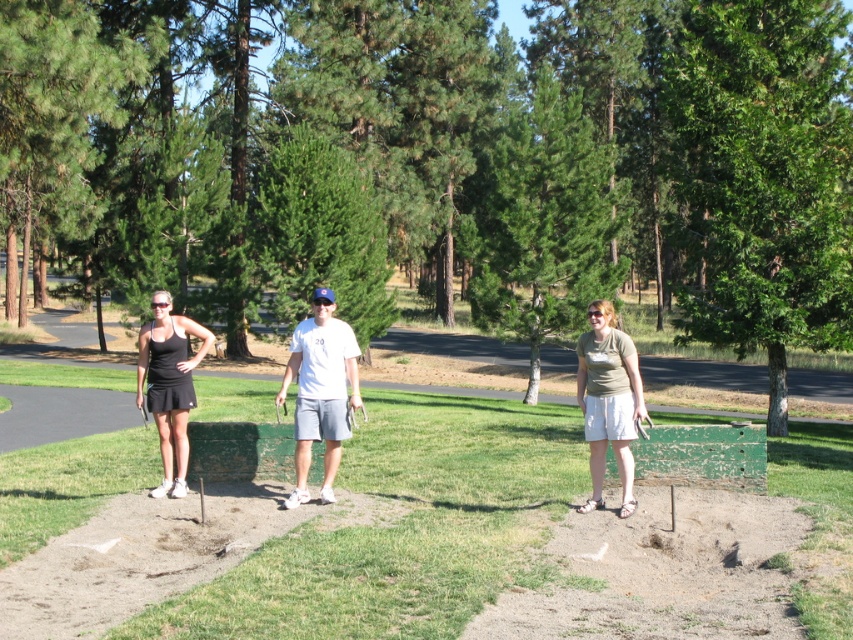
Can you confirm if white cotton t-shirt at center is positioned to the right of black matte tennis skirt at left?

Indeed, white cotton t-shirt at center is positioned on the right side of black matte tennis skirt at left.

Find the location of a particular element. This screenshot has height=640, width=853. white cotton t-shirt at center is located at coordinates click(320, 392).

Where is `white cotton t-shirt at center`? Image resolution: width=853 pixels, height=640 pixels. white cotton t-shirt at center is located at coordinates (320, 392).

Locate an element on the screen. Image resolution: width=853 pixels, height=640 pixels. green painted wood at center is located at coordinates (403, 529).

Does white cotton t-shirt at center appear under black matte tennis racket at left?

No, white cotton t-shirt at center is not below black matte tennis racket at left.

Who is positioned more to the right, white cotton t-shirt at center or black matte tennis racket at left?

From the viewer's perspective, white cotton t-shirt at center appears more on the right side.

Image resolution: width=853 pixels, height=640 pixels. Describe the element at coordinates (320, 392) in the screenshot. I see `white cotton t-shirt at center` at that location.

I want to click on white cotton t-shirt at center, so click(320, 392).